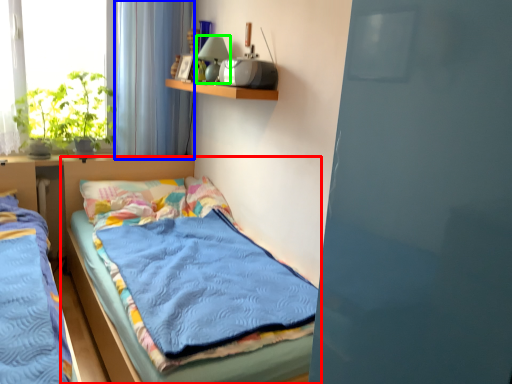
Question: Considering the real-world distances, which object is closest to bed (highlighted by a red box)? curtain (highlighted by a blue box) or lamp (highlighted by a green box).

Choices:
 (A) curtain
 (B) lamp

Answer: (A)